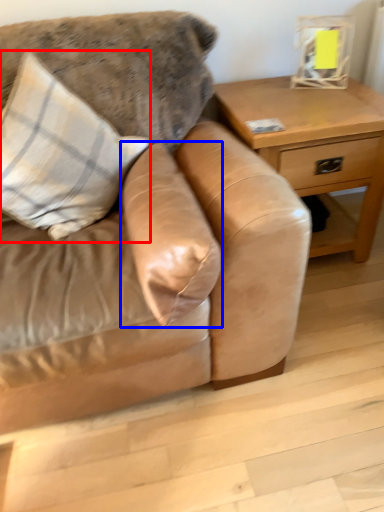
Question: Which point is further to the camera, pillow (highlighted by a red box) or pillow (highlighted by a blue box)?

Choices:
 (A) pillow
 (B) pillow

Answer: (A)